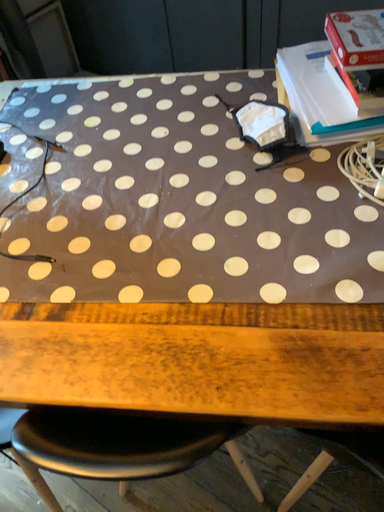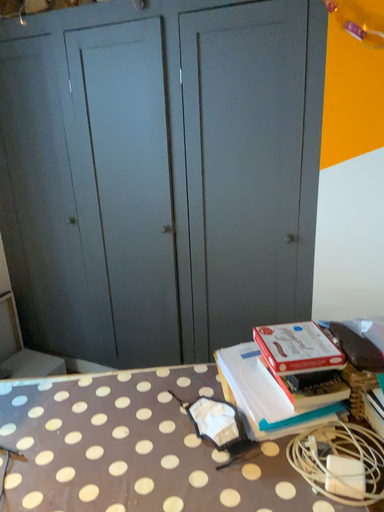
Question: How did the camera likely rotate when shooting the video?

Choices:
 (A) rotated upward
 (B) rotated downward

Answer: (A)